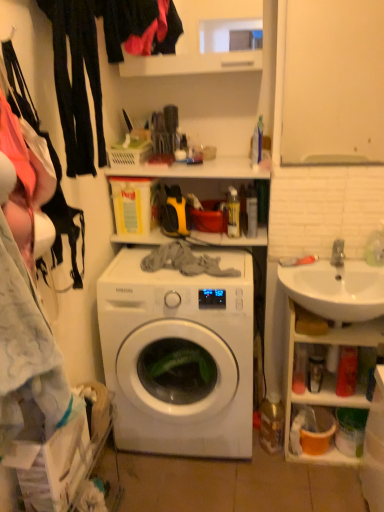
Question: Considering the relative sizes of white ceramic sink at right and white glossy washing machine at center in the image provided, is white ceramic sink at right bigger than white glossy washing machine at center?

Choices:
 (A) yes
 (B) no

Answer: (B)

Question: From the image's perspective, is white ceramic sink at right on white glossy washing machine at center?

Choices:
 (A) no
 (B) yes

Answer: (B)

Question: Is white ceramic sink at right next to white glossy washing machine at center and touching it?

Choices:
 (A) yes
 (B) no

Answer: (B)

Question: Is white ceramic sink at right aimed at white glossy washing machine at center?

Choices:
 (A) no
 (B) yes

Answer: (A)

Question: From the image's perspective, would you say white ceramic sink at right is shown under white glossy washing machine at center?

Choices:
 (A) no
 (B) yes

Answer: (A)

Question: Is white ceramic sink at right facing away from white glossy washing machine at center?

Choices:
 (A) yes
 (B) no

Answer: (B)

Question: Considering the relative sizes of matte black fabric at upper left and white ceramic sink at right in the image provided, is matte black fabric at upper left shorter than white ceramic sink at right?

Choices:
 (A) yes
 (B) no

Answer: (B)

Question: Does matte black fabric at upper left touch white ceramic sink at right?

Choices:
 (A) no
 (B) yes

Answer: (A)

Question: Is white ceramic sink at right at the back of matte black fabric at upper left?

Choices:
 (A) no
 (B) yes

Answer: (A)

Question: Can you confirm if matte black fabric at upper left is thinner than white ceramic sink at right?

Choices:
 (A) yes
 (B) no

Answer: (A)

Question: Is matte black fabric at upper left positioned in front of white ceramic sink at right?

Choices:
 (A) yes
 (B) no

Answer: (A)

Question: From the image's perspective, is matte black fabric at upper left below white ceramic sink at right?

Choices:
 (A) yes
 (B) no

Answer: (B)

Question: Does matte black fabric at upper left appear on the left side of white glossy washing machine at center?

Choices:
 (A) no
 (B) yes

Answer: (B)